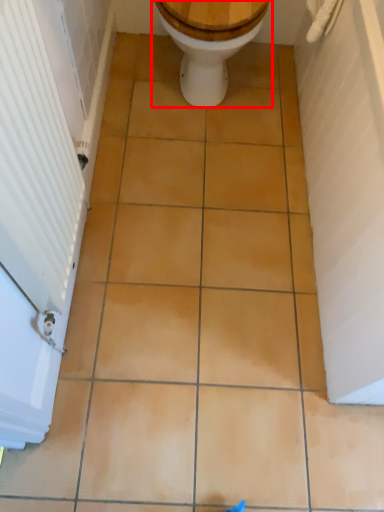
Question: From the image's perspective, where is toilet (annotated by the red box) located in relation to screen door in the image?

Choices:
 (A) below
 (B) above

Answer: (B)